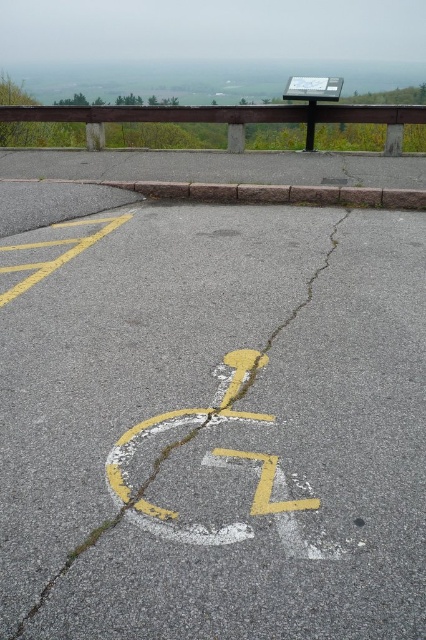
Question: Which point is closer to the camera?

Choices:
 (A) (210, 540)
 (B) (215, 452)
 (C) (97, 184)
 (D) (328, 83)

Answer: (A)

Question: Which object appears farthest from the camera in this image?

Choices:
 (A) brown stone curb at upper center
 (B) white plastic sign at upper center

Answer: (B)

Question: Can you confirm if yellow painted wheelchair symbol at center is bigger than white plastic sign at upper center?

Choices:
 (A) no
 (B) yes

Answer: (B)

Question: Can you confirm if yellow painted wheelchair symbol at center is wider than brown stone curb at upper center?

Choices:
 (A) yes
 (B) no

Answer: (B)

Question: Which point is farther to the camera?

Choices:
 (A) yellow painted wheelchair symbol at center
 (B) brown stone curb at upper center
 (C) white plastic sign at upper center
 (D) yellow chalk circle at center

Answer: (C)

Question: Is yellow painted wheelchair symbol at center bigger than yellow chalk circle at center?

Choices:
 (A) yes
 (B) no

Answer: (A)